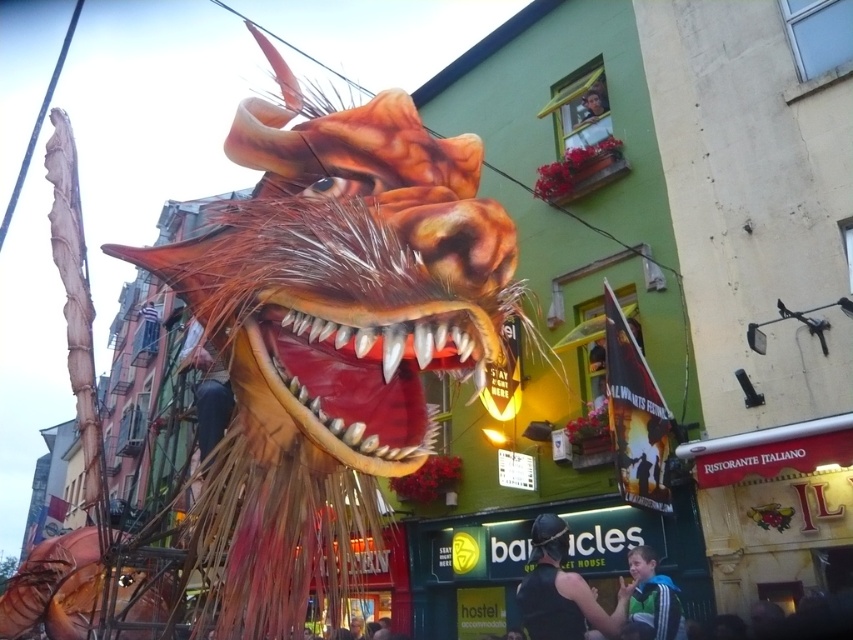
In the scene shown: You are a photographer standing in the middle of the street. You want to capture both the shiny metallic dragon head at center and the green fabric jacket at lower right in the same frame. Based on their positions, which object should you pan your camera towards first to ensure both are in the shot?

The shiny metallic dragon head at center is positioned on the left side of green fabric jacket at lower right. Therefore, you should pan your camera towards the shiny metallic dragon head at center first to include both objects in the frame.

In the scene shown: You are a photographer holding a camera and standing near the dragon head. You want to take a photo of the black leather jacket at center without moving your position. Is the jacket within your camera lens range if your camera can focus up to 3 meters?

The black leather jacket at center and camera are 3.42 meters apart from each other. Since the camera can focus up to 3 meters, the jacket is slightly out of range and cannot be focused clearly without moving closer.

You are a photographer standing in the middle of the street. You want to take a photo that includes both the shiny metallic dragon head at center and the black leather jacket at center. Since you have a wide angle lens, you can adjust the focus to highlight one object while keeping the other in the frame. Which object will appear wider in your photo?

The shiny metallic dragon head at center will appear wider in the photo because its width surpasses that of the black leather jacket at center.